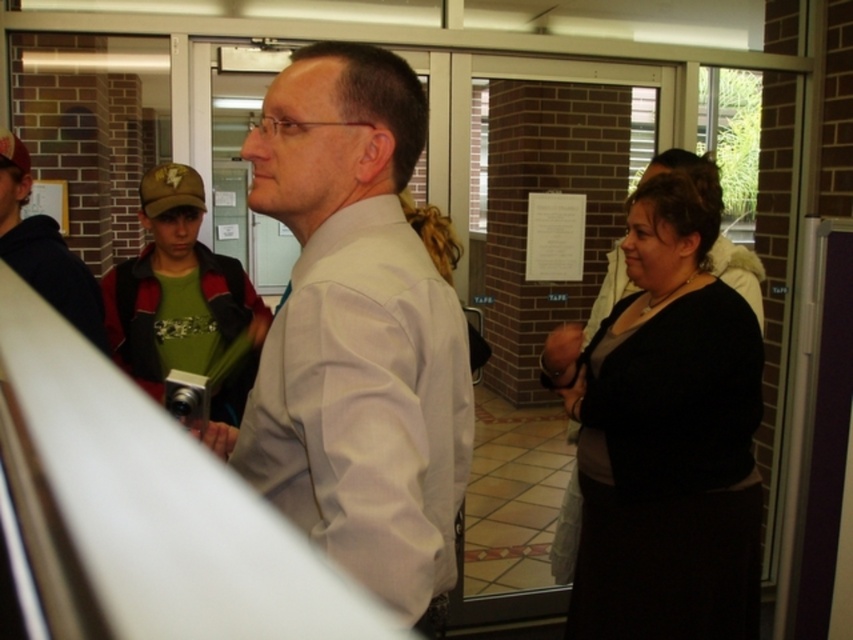
Question: Considering the real-world distances, which object is closest to the black matte dress at right?

Choices:
 (A) white smooth shirt at center
 (B) dark green hoodie at left
 (C) matte white shirt at center

Answer: (A)

Question: Can you confirm if white smooth shirt at center is bigger than black matte dress at right?

Choices:
 (A) yes
 (B) no

Answer: (B)

Question: Is matte white shirt at center smaller than dark green hoodie at left?

Choices:
 (A) no
 (B) yes

Answer: (A)

Question: Which of the following is the farthest from the observer?

Choices:
 (A) (332, 419)
 (B) (77, 289)

Answer: (B)

Question: Which of these objects is positioned closest to the dark green hoodie at left?

Choices:
 (A) white smooth shirt at center
 (B) matte white shirt at center
 (C) black matte dress at right

Answer: (B)

Question: In this image, where is black matte dress at right located relative to dark green hoodie at left?

Choices:
 (A) below
 (B) above

Answer: (A)